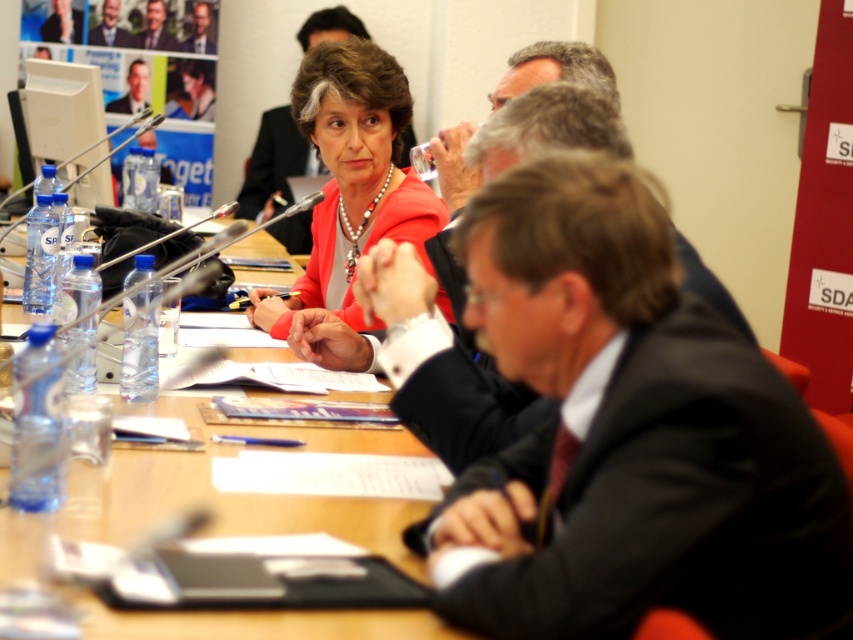
Does smooth black suit at upper center appear on the right side of smooth gray suit at upper left?

Correct, you'll find smooth black suit at upper center to the right of smooth gray suit at upper left.

Between smooth black suit at upper center and smooth gray suit at upper left, which one has more height?

Standing taller between the two is smooth black suit at upper center.

Locate an element on the screen. This screenshot has width=853, height=640. smooth black suit at upper center is located at coordinates (155, 29).

You are a GUI agent. You are given a task and a screenshot of the screen. Output one action in this format:
    pyautogui.click(x=<x>, y=<y>)
    Task: Click on the smooth black suit at upper center
    
    Given the screenshot: What is the action you would take?
    pyautogui.click(x=155, y=29)

Between wooden table at center and matte red dress at center, which one appears on the left side from the viewer's perspective?

From the viewer's perspective, wooden table at center appears more on the left side.

Who is more forward, [397,502] or [431,193]?

Point [397,502]

Locate an element on the screen. The image size is (853, 640). wooden table at center is located at coordinates (190, 504).

Identify the location of wooden table at center. (190, 504).

Consider the image. Does wooden table at center have a larger size compared to matte black suit at center?

Yes.

Between point (364, 508) and point (741, 328), which one is positioned behind?

Point (364, 508)

Locate an element on the screen. wooden table at center is located at coordinates (190, 504).